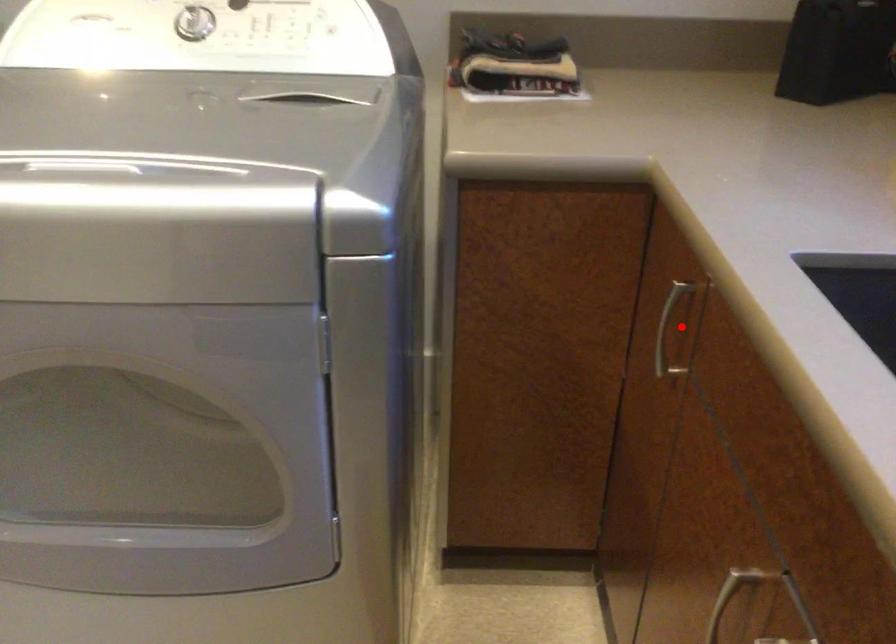
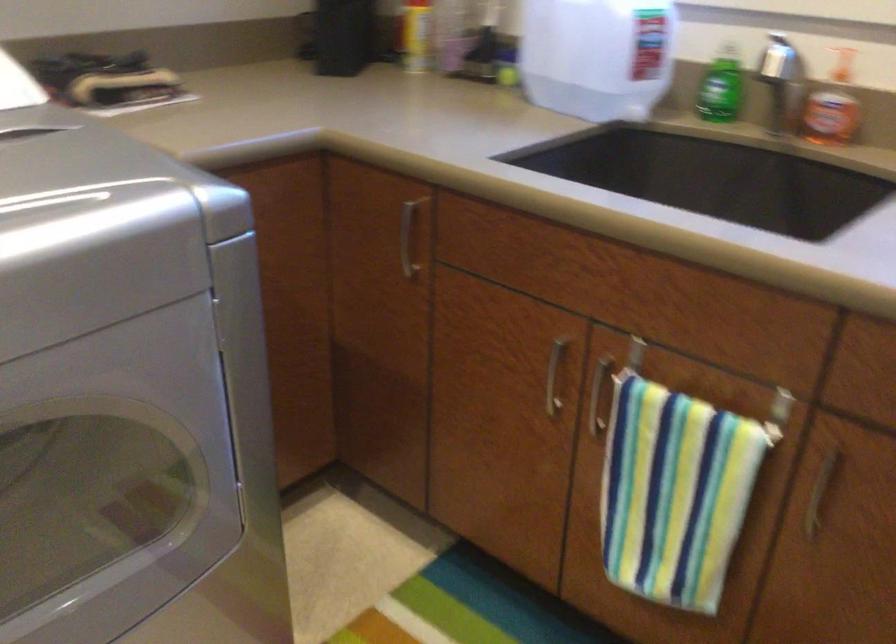
Question: I am providing you with two images of the same scene from different viewpoints. A red point is shown in image1. For the corresponding object point in image2, is it positioned nearer or farther from the camera?

Choices:
 (A) Nearer
 (B) Farther

Answer: (B)